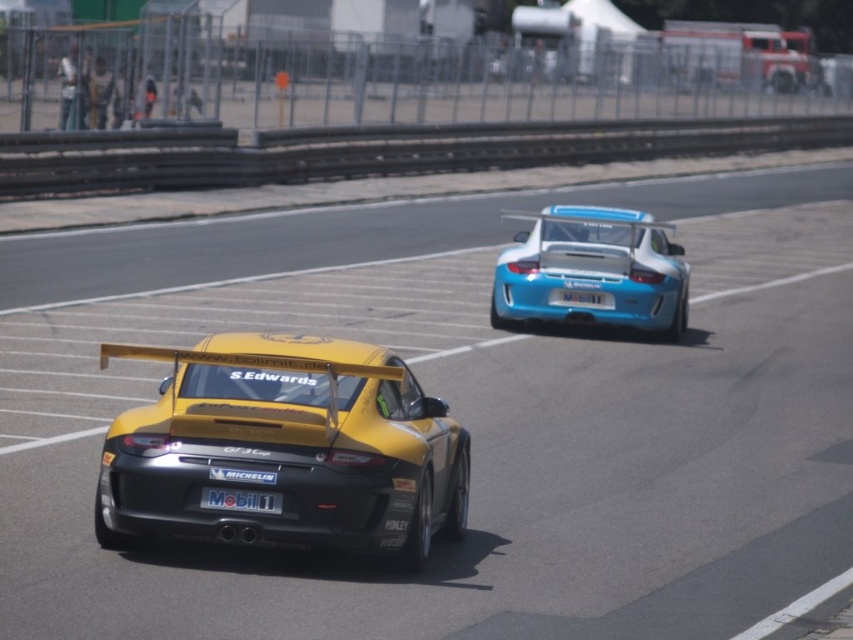
Question: Where is yellow matte/satin sports car at center located in relation to blue glossy license plate at rear in the image?

Choices:
 (A) above
 (B) below

Answer: (B)

Question: Does yellow matte/satin sports car at center appear on the right side of white glossy license plate at rear?

Choices:
 (A) yes
 (B) no

Answer: (A)

Question: Estimate the real-world distances between objects in this image. Which object is closer to the blue glossy license plate at rear?

Choices:
 (A) white glossy license plate at rear
 (B) yellow matte/satin sports car at center
 (C) shiny blue car at upper right

Answer: (C)

Question: Does yellow matte/satin sports car at center come in front of blue glossy license plate at rear?

Choices:
 (A) no
 (B) yes

Answer: (B)

Question: Among these points, which one is nearest to the camera?

Choices:
 (A) (262, 492)
 (B) (561, 298)
 (C) (194, 483)

Answer: (A)

Question: Among these points, which one is nearest to the camera?

Choices:
 (A) (322, 509)
 (B) (606, 307)

Answer: (A)